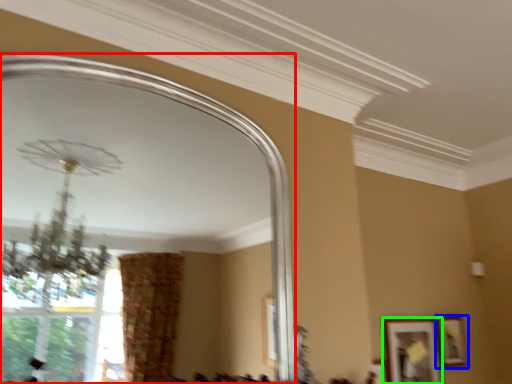
Question: Which object is positioned closest to mirror (highlighted by a red box)? Select from picture frame (highlighted by a blue box) and picture frame (highlighted by a green box).

Choices:
 (A) picture frame
 (B) picture frame

Answer: (B)